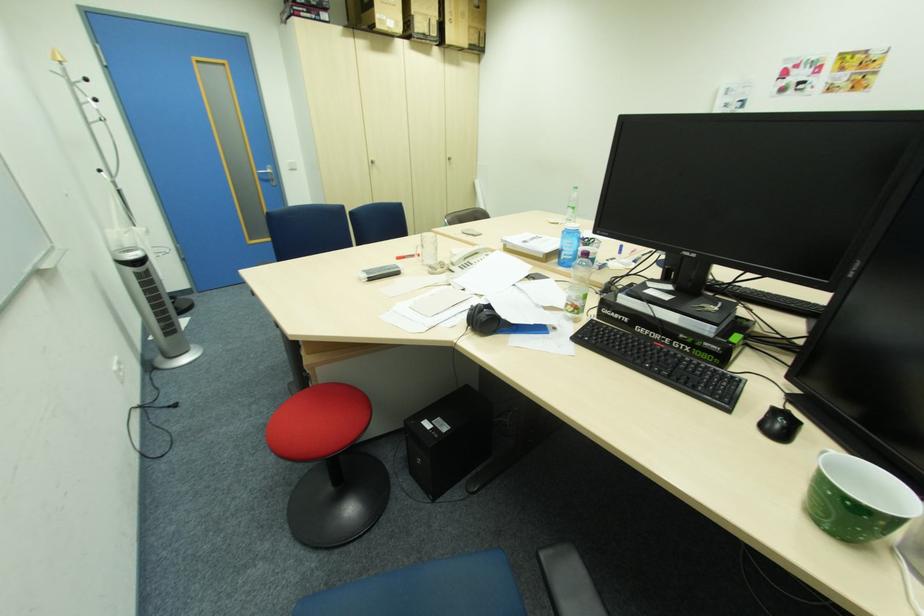
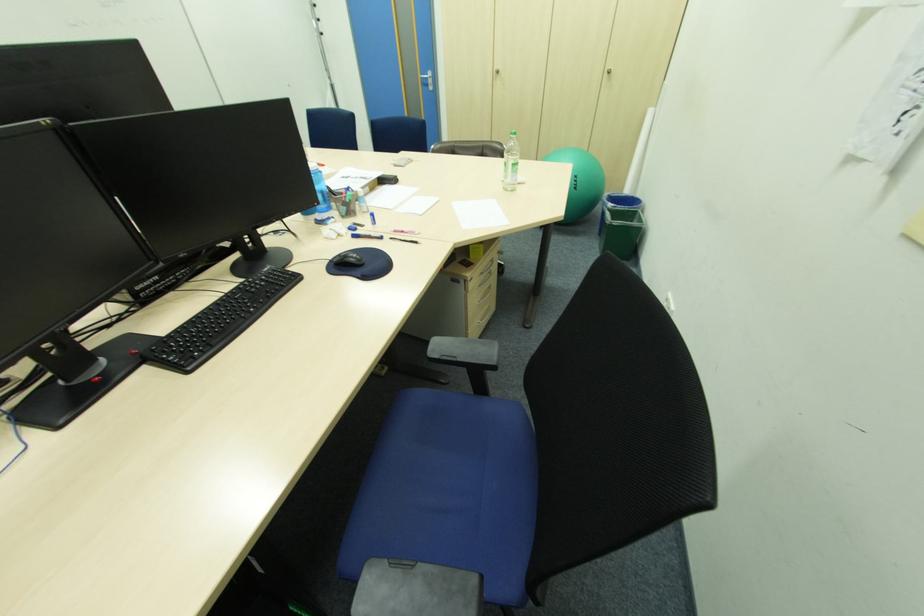
Question: I am providing you with two images of the same scene from different viewpoints. Please identify which objects are invisible in image2.

Choices:
 (A) clear pen holder
 (B) turquoise object
 (C) blue chair sitting surface
 (D) black headphones

Answer: (D)